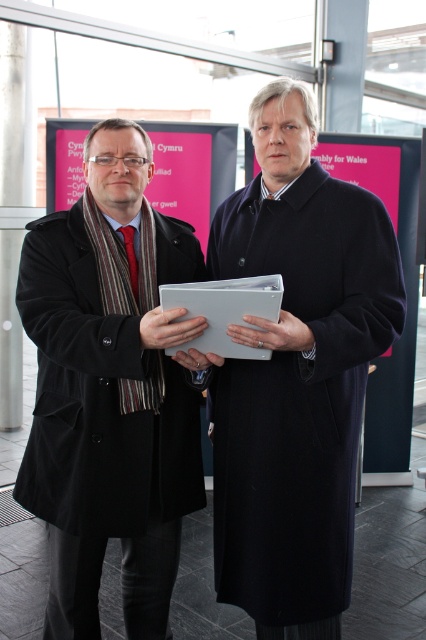
Which is behind, point (290, 284) or point (63, 221)?

Positioned behind is point (63, 221).

Is dark wool coat at center thinner than black matte coat at left?

In fact, dark wool coat at center might be wider than black matte coat at left.

Image resolution: width=426 pixels, height=640 pixels. I want to click on dark wool coat at center, so click(296, 374).

Where is `dark wool coat at center`? The image size is (426, 640). dark wool coat at center is located at coordinates (296, 374).

Does dark wool coat at center have a greater width compared to matte gray folder at center?

Yes.

Which is more to the right, dark wool coat at center or matte gray folder at center?

dark wool coat at center is more to the right.

Between point (344, 438) and point (227, 321), which one is positioned behind?

The point (344, 438) is more distant.

Where is `dark wool coat at center`? This screenshot has height=640, width=426. dark wool coat at center is located at coordinates (296, 374).

How far apart are black matte coat at left and matte gray folder at center?

They are 10.47 inches apart.

Does black matte coat at left have a greater height compared to matte gray folder at center?

Yes, black matte coat at left is taller than matte gray folder at center.

What do you see at coordinates (109, 388) in the screenshot?
I see `black matte coat at left` at bounding box center [109, 388].

This screenshot has height=640, width=426. In order to click on black matte coat at left in this screenshot , I will do `click(109, 388)`.